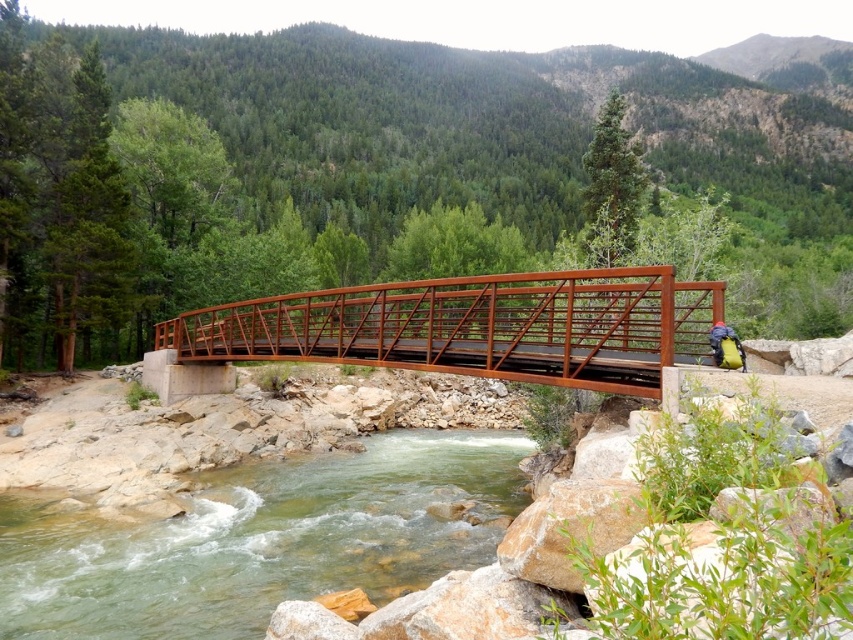
Who is taller, green smooth water at center or rustic metal bridge at center?

rustic metal bridge at center

Does point (387, 524) lie in front of point (469, 340)?

No, it is not.

You are a GUI agent. You are given a task and a screenshot of the screen. Output one action in this format:
    pyautogui.click(x=<x>, y=<y>)
    Task: Click on the green smooth water at center
    The width and height of the screenshot is (853, 640).
    Given the screenshot: What is the action you would take?
    pyautogui.click(x=258, y=540)

Can you confirm if green smooth water at center is positioned to the right of yellow fabric backpack at center-right?

In fact, green smooth water at center is to the left of yellow fabric backpack at center-right.

Is green smooth water at center positioned before yellow fabric backpack at center-right?

Yes.

Who is more distant from viewer, (x=399, y=454) or (x=715, y=321)?

Positioned behind is point (x=399, y=454).

The image size is (853, 640). What are the coordinates of `green smooth water at center` in the screenshot? It's located at (258, 540).

Which is above, rustic metal bridge at center or yellow fabric backpack at center-right?

rustic metal bridge at center is higher up.

Is rustic metal bridge at center closer to camera compared to yellow fabric backpack at center-right?

That is True.

Between point (345, 356) and point (743, 368), which one is positioned behind?

Point (345, 356)

Image resolution: width=853 pixels, height=640 pixels. In order to click on rustic metal bridge at center in this screenshot , I will do `click(463, 328)`.